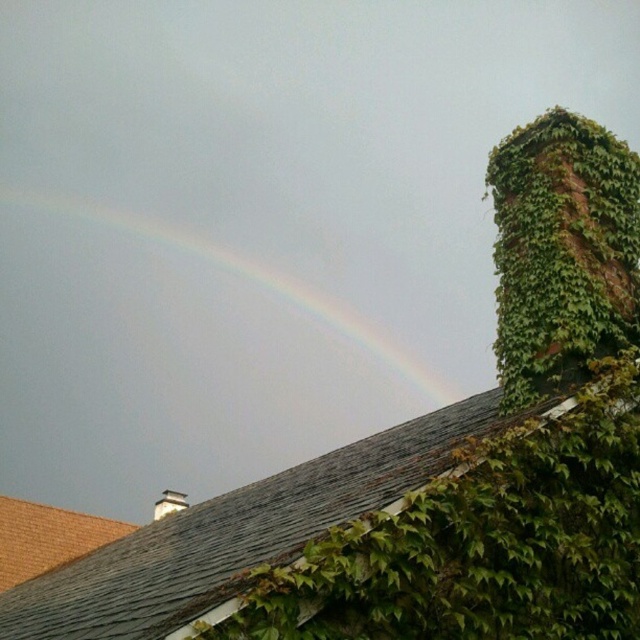
Question: Which point is closer to the camera?

Choices:
 (A) (630, 339)
 (B) (166, 492)

Answer: (A)

Question: Is green leafy ivy at upper right positioned before rainbow at upper left?

Choices:
 (A) no
 (B) yes

Answer: (B)

Question: Does green leafy ivy at upper right have a larger size compared to white brick chimney at upper center?

Choices:
 (A) no
 (B) yes

Answer: (A)

Question: Where is green leafy ivy at upper right located in relation to white brick chimney at upper center in the image?

Choices:
 (A) above
 (B) below

Answer: (A)

Question: Which point appears farthest from the camera in this image?

Choices:
 (A) (168, 502)
 (B) (595, 236)

Answer: (A)

Question: Which point appears closest to the camera in this image?

Choices:
 (A) (161, 492)
 (B) (538, 145)

Answer: (B)